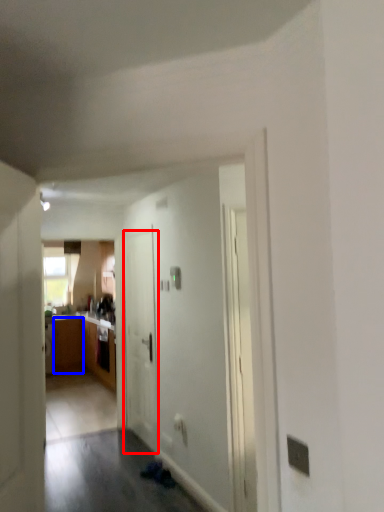
Question: Which point is further to the camera, door (highlighted by a red box) or cabinetry (highlighted by a blue box)?

Choices:
 (A) door
 (B) cabinetry

Answer: (B)